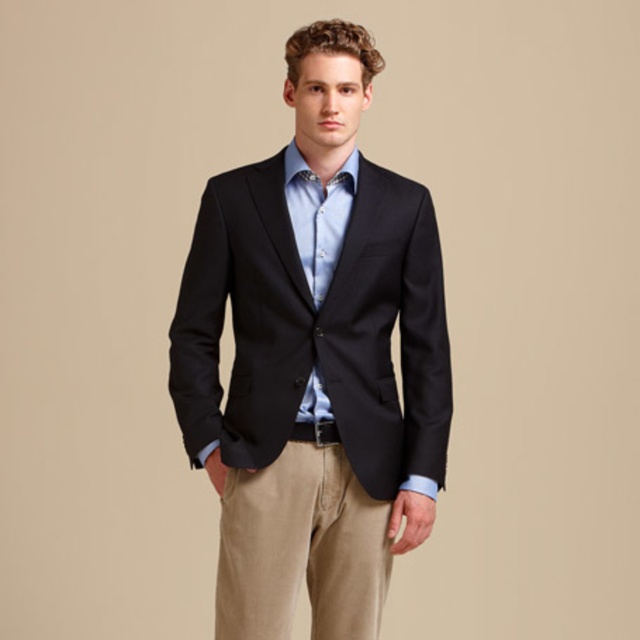
You are a photographer standing at a certain distance from the subject. You need to ensure that your camera is positioned exactly 2 meters away from the point marked as point (432,285) to capture the perfect shot. Based on the scene description, is your current position correct?

The distance between point (432,285) and the camera is 1.87 meters. Since the required distance is 2 meters, you need to move 0.13 meters further away from the point to achieve the correct positioning.

You are a fashion designer trying to sketch this outfit. You need to place the khaki cotton pants at lower center in your drawing. What are the coordinates where you should place them?

The khaki cotton pants at lower center should be placed at coordinates point (300, 547).

Based on the scene description, can you determine if the matte black blazer at center is wider than the light blue cotton shirt at center?

The matte black blazer at center might be wider than light blue cotton shirt at center according to the description.